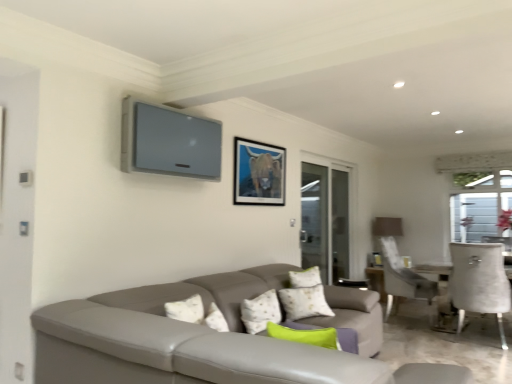
Question: Considering the positions of point pos(308,258) and point pos(266,309), is point pos(308,258) closer or farther from the camera than point pos(266,309)?

Choices:
 (A) farther
 (B) closer

Answer: (A)

Question: Considering the positions of transparent glass screen door at right and green fabric pillow at center in the image, is transparent glass screen door at right bigger or smaller than green fabric pillow at center?

Choices:
 (A) small
 (B) big

Answer: (B)

Question: Based on their relative distances, which object is farther from the matte black picture frame at upper center?

Choices:
 (A) green fabric pillow at center
 (B) transparent glass screen door at right

Answer: (B)

Question: Which object is the farthest from the matte black picture frame at upper center?

Choices:
 (A) green fabric pillow at center
 (B) transparent glass screen door at right

Answer: (B)